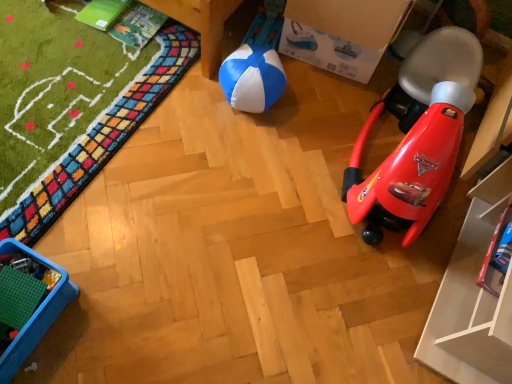
What are the coordinates of `red plastic rocket at right, arranged as the second toy when ordered from the bottom` in the screenshot? It's located at (418, 138).

Measure the distance between point (x=483, y=270) and camera.

Point (x=483, y=270) is 1.23 meters away from camera.

What do you see at coordinates (252, 78) in the screenshot? I see `blue/white fabric ball at center` at bounding box center [252, 78].

Identify the location of red plastic rocket at right, arranged as the second toy when ordered from the bottom. (418, 138).

Is blue plastic tray at lower left facing towards blue/white fabric ball at center?

Yes.

How much distance is there between blue plastic tray at lower left and blue/white fabric ball at center?

They are 35.31 inches apart.

Which of these two, blue plastic tray at lower left or blue/white fabric ball at center, is thinner?

Thinner between the two is blue/white fabric ball at center.

Is blue plastic tray at lower left next to blue/white fabric ball at center?

No.

Is cardboard box at upper center closer to the viewer compared to blue/white fabric ball at center?

Yes, it is in front of blue/white fabric ball at center.

Is cardboard box at upper center at the right side of blue/white fabric ball at center?

Yes.

Between cardboard box at upper center and blue/white fabric ball at center, which one has smaller size?

blue/white fabric ball at center.

Which is correct: red plastic rocket at right, arranged as the second toy when ordered from the bottom, is inside metallic blue toy car at lower right, the second toy from the top, or outside of it?

red plastic rocket at right, arranged as the second toy when ordered from the bottom, is not enclosed by metallic blue toy car at lower right, the second toy from the top.

Is red plastic rocket at right, positioned as the 1th toy in top-to-bottom order, smaller than metallic blue toy car at lower right, the second toy from the top?

Incorrect, red plastic rocket at right, positioned as the 1th toy in top-to-bottom order, is not smaller in size than metallic blue toy car at lower right, the second toy from the top.

Can you confirm if red plastic rocket at right, positioned as the 1th toy in top-to-bottom order, is positioned to the left of metallic blue toy car at lower right, which is counted as the 1th toy, starting from the bottom?

Indeed, red plastic rocket at right, positioned as the 1th toy in top-to-bottom order, is positioned on the left side of metallic blue toy car at lower right, which is counted as the 1th toy, starting from the bottom.

From the image's perspective, which is below, red plastic rocket at right, positioned as the 1th toy in top-to-bottom order, or metallic blue toy car at lower right, which is counted as the 1th toy, starting from the bottom?

metallic blue toy car at lower right, which is counted as the 1th toy, starting from the bottom, is shown below in the image.

From a real-world perspective, which object rests below the other?

blue plastic tray at lower left, from a real-world perspective.

Which is more to the right, cardboard box at upper center or blue plastic tray at lower left?

From the viewer's perspective, cardboard box at upper center appears more on the right side.

Which of these two, cardboard box at upper center or blue plastic tray at lower left, is bigger?

Bigger between the two is cardboard box at upper center.

Would you say blue/white fabric ball at center is outside red plastic rocket at right, arranged as the second toy when ordered from the bottom?

Indeed, blue/white fabric ball at center is completely outside red plastic rocket at right, arranged as the second toy when ordered from the bottom.

From a real-world perspective, is blue/white fabric ball at center under red plastic rocket at right, positioned as the 1th toy in top-to-bottom order?

Yes, from a real-world perspective, blue/white fabric ball at center is beneath red plastic rocket at right, positioned as the 1th toy in top-to-bottom order.

Considering the relative positions of blue/white fabric ball at center and red plastic rocket at right, arranged as the second toy when ordered from the bottom, in the image provided, is blue/white fabric ball at center to the left of red plastic rocket at right, arranged as the second toy when ordered from the bottom, from the viewer's perspective?

Indeed, blue/white fabric ball at center is positioned on the left side of red plastic rocket at right, arranged as the second toy when ordered from the bottom.

Is blue/white fabric ball at center wider than red plastic rocket at right, positioned as the 1th toy in top-to-bottom order?

No.

In the scene shown: Which is more to the left, red plastic rocket at right, positioned as the 1th toy in top-to-bottom order, or blue/white fabric ball at center?

blue/white fabric ball at center is more to the left.

Between red plastic rocket at right, arranged as the second toy when ordered from the bottom, and blue/white fabric ball at center, which one has smaller width?

With smaller width is blue/white fabric ball at center.

From a real-world perspective, between red plastic rocket at right, arranged as the second toy when ordered from the bottom, and blue/white fabric ball at center, who is vertically higher?

red plastic rocket at right, arranged as the second toy when ordered from the bottom, is physically above.

Is red plastic rocket at right, positioned as the 1th toy in top-to-bottom order, beside blue/white fabric ball at center?

No, red plastic rocket at right, positioned as the 1th toy in top-to-bottom order, is not in contact with blue/white fabric ball at center.

Is blue plastic tray at lower left looking in the opposite direction of cardboard box at upper center?

That's not correct — blue plastic tray at lower left is not looking away from cardboard box at upper center.

Where is `furniture in front of the cardboard box at upper center`? The height and width of the screenshot is (384, 512). furniture in front of the cardboard box at upper center is located at coordinates (35, 313).

From the image's perspective, is blue plastic tray at lower left located above cardboard box at upper center?

No, from the image's perspective, blue plastic tray at lower left is not over cardboard box at upper center.

Can you confirm if blue plastic tray at lower left is positioned to the left of cardboard box at upper center?

Indeed, blue plastic tray at lower left is positioned on the left side of cardboard box at upper center.

Where is `furniture in front of the blue/white fabric ball at center`? furniture in front of the blue/white fabric ball at center is located at coordinates (35, 313).

Locate an element on the screen. cardboard box above the blue/white fabric ball at center (from a real-world perspective) is located at coordinates (342, 33).

Which object lies nearer to the anchor point metallic blue toy car at lower right, which is counted as the 1th toy, starting from the bottom, blue/white fabric ball at center or blue plastic tray at lower left?

blue/white fabric ball at center is closer to metallic blue toy car at lower right, which is counted as the 1th toy, starting from the bottom.

Estimate the real-world distances between objects in this image. Which object is further from blue/white fabric ball at center, red plastic rocket at right, arranged as the second toy when ordered from the bottom, or blue plastic tray at lower left?

blue plastic tray at lower left.

Looking at this image, when comparing their distances from cardboard box at upper center, does blue plastic tray at lower left or blue/white fabric ball at center seem closer?

blue/white fabric ball at center is positioned closer to the anchor cardboard box at upper center.

From the image, which object appears to be nearer to cardboard box at upper center, red plastic rocket at right, positioned as the 1th toy in top-to-bottom order, or blue/white fabric ball at center?

Based on the image, blue/white fabric ball at center appears to be nearer to cardboard box at upper center.

From the image, which object appears to be nearer to blue plastic tray at lower left, blue/white fabric ball at center or metallic blue toy car at lower right, the second toy from the top?

Among the two, blue/white fabric ball at center is located nearer to blue plastic tray at lower left.

Considering their positions, is blue plastic tray at lower left positioned further to metallic blue toy car at lower right, the second toy from the top, than blue/white fabric ball at center?

blue plastic tray at lower left.

When comparing their distances from blue plastic tray at lower left, does metallic blue toy car at lower right, which is counted as the 1th toy, starting from the bottom, or blue/white fabric ball at center seem further?

metallic blue toy car at lower right, which is counted as the 1th toy, starting from the bottom, is positioned further to the anchor blue plastic tray at lower left.

Looking at the image, which one is located closer to blue/white fabric ball at center, blue plastic tray at lower left or cardboard box at upper center?

cardboard box at upper center.

The width and height of the screenshot is (512, 384). Find the location of `toy that lies between cardboard box at upper center and metallic blue toy car at lower right, the second toy from the top, from top to bottom`. toy that lies between cardboard box at upper center and metallic blue toy car at lower right, the second toy from the top, from top to bottom is located at coordinates (418, 138).

Locate an element on the screen. Image resolution: width=512 pixels, height=384 pixels. ball between cardboard box at upper center and blue plastic tray at lower left from top to bottom is located at coordinates (252, 78).

Image resolution: width=512 pixels, height=384 pixels. Identify the location of ball between cardboard box at upper center and metallic blue toy car at lower right, the second toy from the top, vertically. (252, 78).

Where is `toy between blue/white fabric ball at center and metallic blue toy car at lower right, which is counted as the 1th toy, starting from the bottom, in the horizontal direction`? toy between blue/white fabric ball at center and metallic blue toy car at lower right, which is counted as the 1th toy, starting from the bottom, in the horizontal direction is located at coordinates (418, 138).